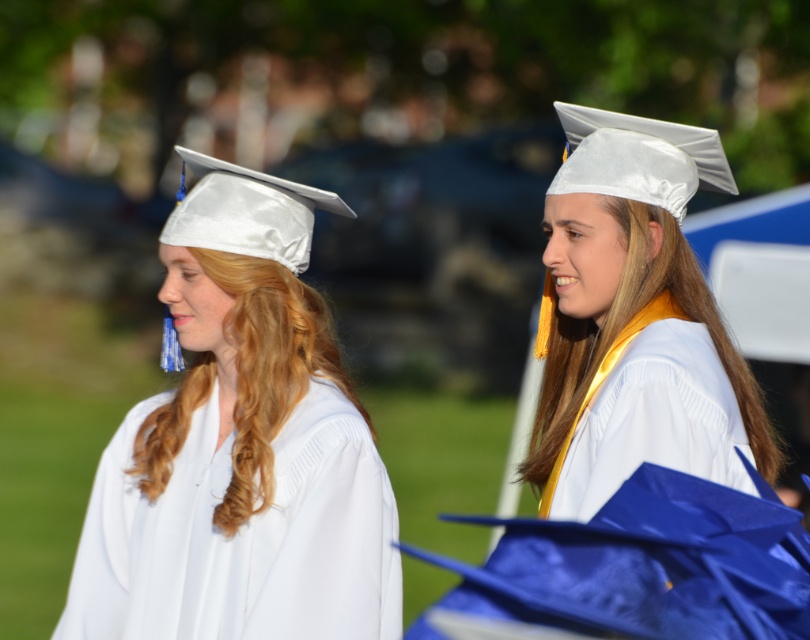
Which is below, white satin graduation cap at left or white satin graduation gown at center?

white satin graduation gown at center is lower down.

Is white satin graduation cap at left to the right of white satin graduation gown at center from the viewer's perspective?

Incorrect, white satin graduation cap at left is not on the right side of white satin graduation gown at center.

The height and width of the screenshot is (640, 810). I want to click on white satin graduation cap at left, so click(x=241, y=448).

I want to click on white satin graduation cap at left, so click(241, 448).

Can you confirm if white satin graduation cap at center is bigger than white satin graduation gown at center?

Correct, white satin graduation cap at center is larger in size than white satin graduation gown at center.

Who is lower down, white satin graduation cap at center or white satin graduation gown at center?

white satin graduation gown at center is below.

Is point (704, 342) less distant than point (570, 508)?

No, (704, 342) is further to viewer.

Image resolution: width=810 pixels, height=640 pixels. I want to click on white satin graduation cap at center, so click(x=633, y=317).

Is white satin graduation cap at left wider than white satin graduation cap at center?

Yes.

Describe the element at coordinates (241, 448) in the screenshot. I see `white satin graduation cap at left` at that location.

The height and width of the screenshot is (640, 810). What are the coordinates of `white satin graduation cap at left` in the screenshot? It's located at (241, 448).